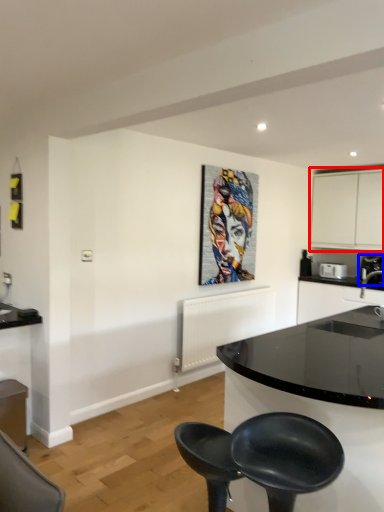
Question: Which object is further to the camera taking this photo, cabinetry (highlighted by a red box) or coffee machine (highlighted by a blue box)?

Choices:
 (A) cabinetry
 (B) coffee machine

Answer: (A)